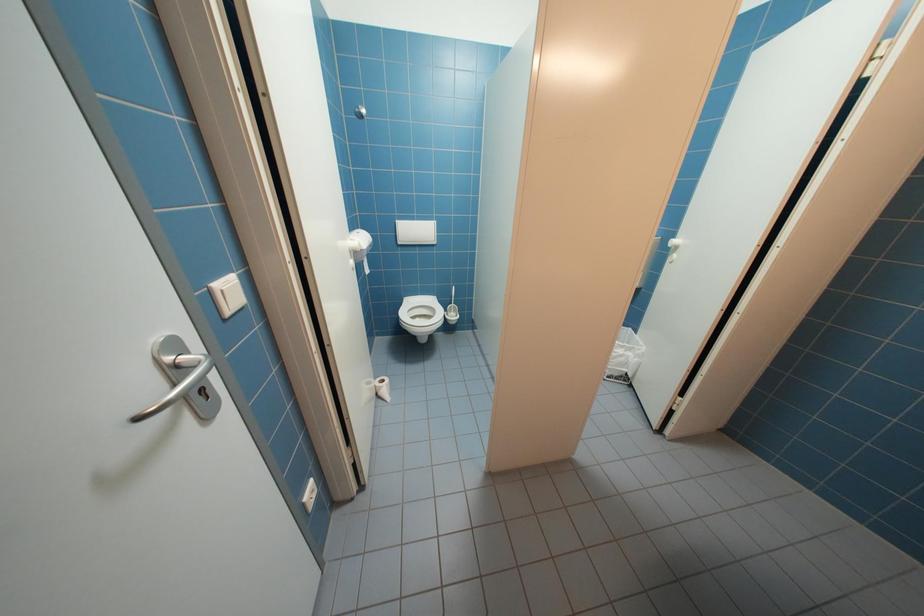
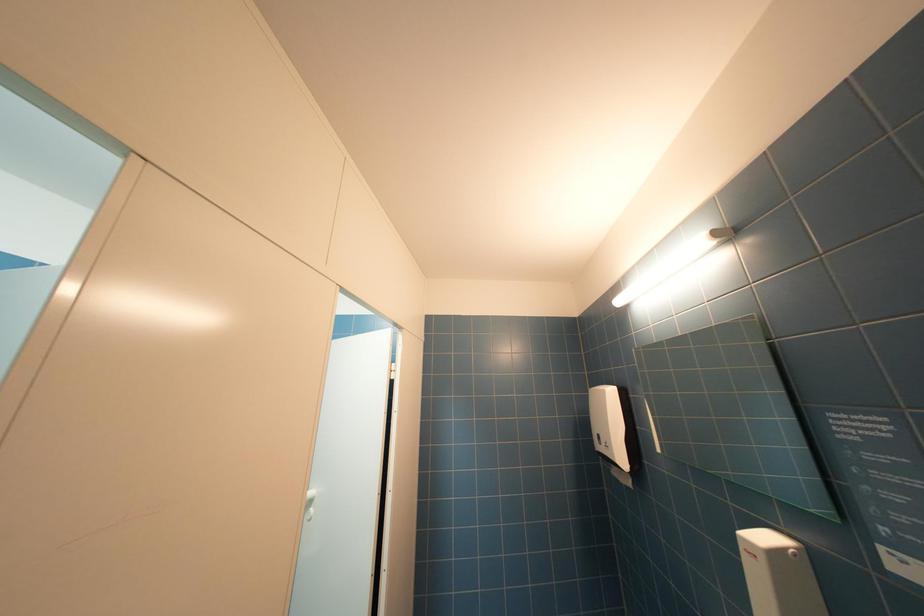
How did the camera likely rotate?

The rotation direction of the camera is right-up.